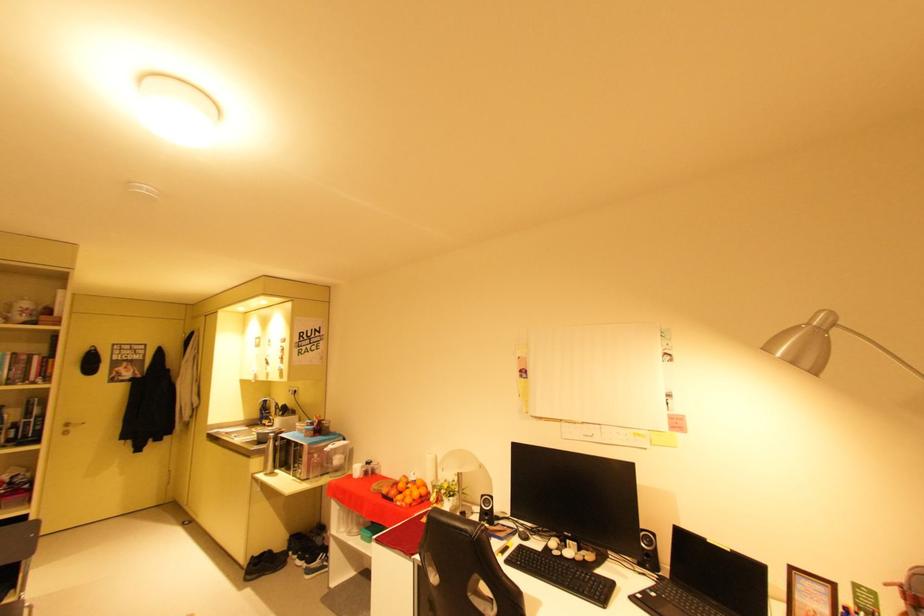
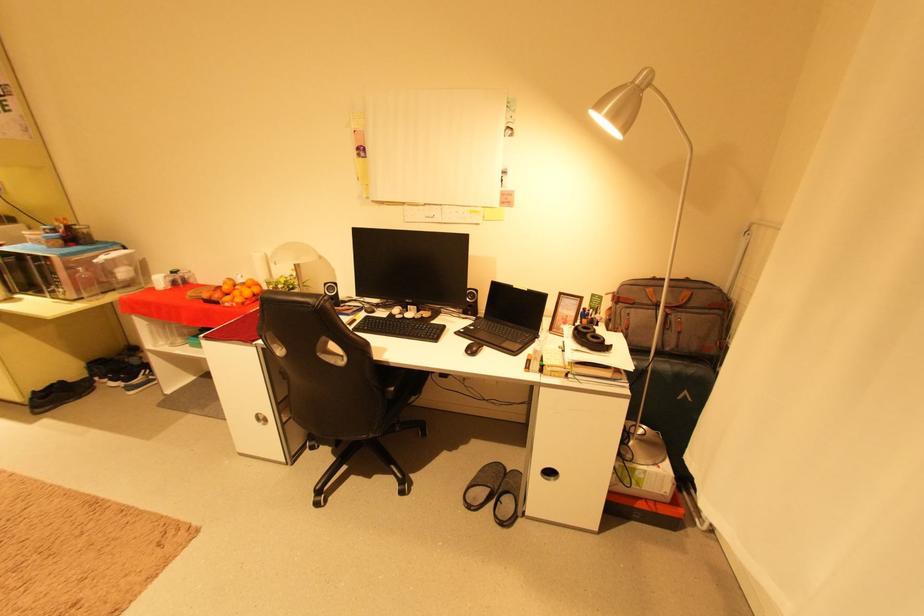
Find the pixel in the second image that matches [490,496] in the first image.

(333, 285)